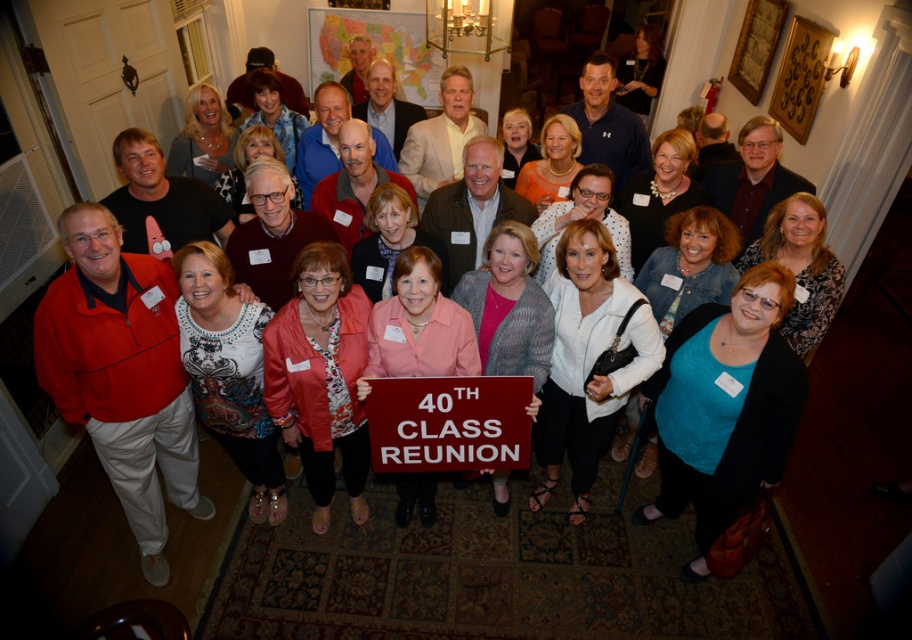
Question: Which object is closer to the camera taking this photo?

Choices:
 (A) light beige suit at center
 (B) matte black shirt at center
 (C) maroon plastic sign at center
 (D) matte red jacket at center

Answer: (D)

Question: Which point appears farthest from the camera in this image?

Choices:
 (A) (377, 109)
 (B) (739, 172)
 (C) (791, 195)

Answer: (A)

Question: Can you confirm if maroon plastic sign at center is thinner than matte white shirt at center?

Choices:
 (A) no
 (B) yes

Answer: (A)

Question: Is patterned fabric dress at center closer to the viewer compared to light beige suit at center?

Choices:
 (A) no
 (B) yes

Answer: (B)

Question: Among these points, which one is nearest to the camera?

Choices:
 (A) (459, 424)
 (B) (724, 163)
 (C) (811, 241)

Answer: (A)

Question: Does matte red jacket at center appear under white textured sweater at center?

Choices:
 (A) no
 (B) yes

Answer: (A)